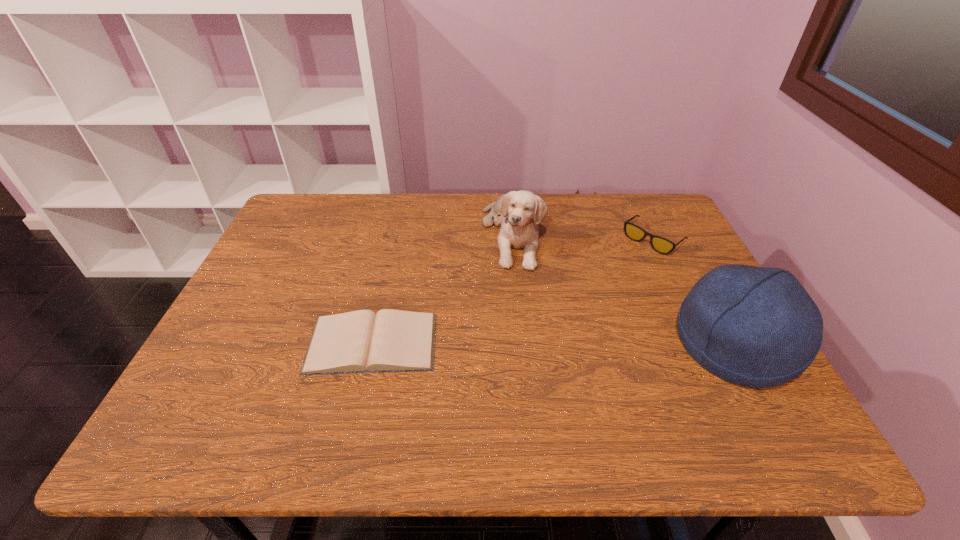
The image size is (960, 540). Find the location of `free point between the Bible and the sunglasses`. free point between the Bible and the sunglasses is located at coordinates (513, 291).

This screenshot has height=540, width=960. Find the location of `free space between the puppy and the third tallest object`. free space between the puppy and the third tallest object is located at coordinates (582, 237).

Identify which object is the third closest to the second tallest object. Please provide its 2D coordinates. Your answer should be formatted as a tuple, i.e. [(x, y)], where the tuple contains the x and y coordinates of a point satisfying the conditions above.

[(757, 327)]

Identify which object is located as the third nearest to the second tallest object. Please provide its 2D coordinates. Your answer should be formatted as a tuple, i.e. [(x, y)], where the tuple contains the x and y coordinates of a point satisfying the conditions above.

[(757, 327)]

Locate an element on the screen. The width and height of the screenshot is (960, 540). vacant space that satisfies the following two spatial constraints: 1. on the front side of the third object from right to left; 2. on the left side of the tallest object is located at coordinates (521, 343).

What are the coordinates of `vacant position in the image that satisfies the following two spatial constraints: 1. on the front side of the third object from right to left; 2. on the right side of the skullcap` in the screenshot? It's located at (521, 343).